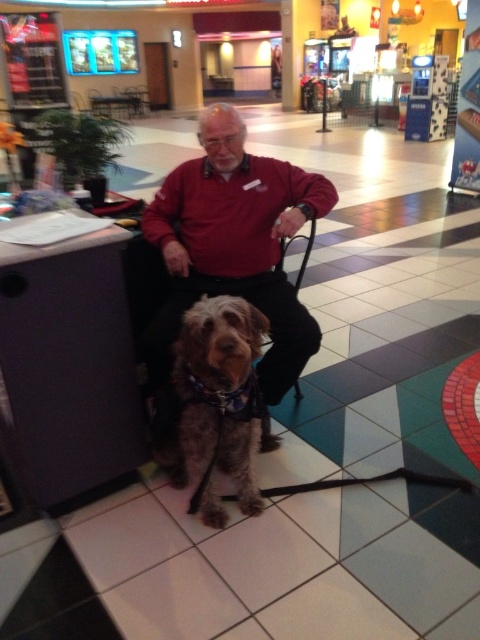
You are a photographer taking a picture of the matte red shirt at center and the fuzzy brown dog at center. Which object will appear bigger in the photo?

The matte red shirt at center will appear bigger in the photo because it is larger in size than the fuzzy brown dog at center.

You are a service robot in a mall. You need to deliver a package to the person wearing the matte red shirt at center. However, there is a fuzzy brown dog at center nearby. What is the shortest distance you must maintain between the package and the dog to ensure it reaches the person safely?

The shortest distance you must maintain between the package and the fuzzy brown dog at center is 11.81 inches to ensure it reaches the person wearing the matte red shirt at center safely.